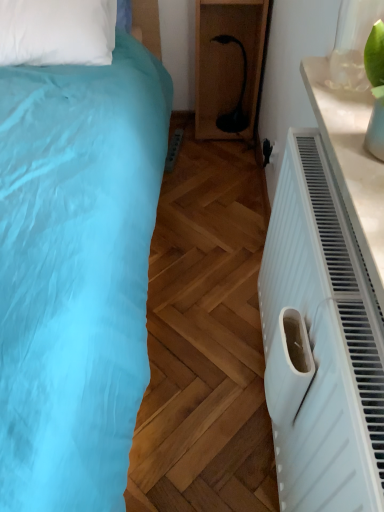
Question: Is black plastic lamp at center wider than white plastic electric outlet at center-right?

Choices:
 (A) no
 (B) yes

Answer: (B)

Question: Is black plastic lamp at center located outside white plastic electric outlet at center-right?

Choices:
 (A) no
 (B) yes

Answer: (B)

Question: From the image's perspective, does black plastic lamp at center appear higher than white plastic electric outlet at center-right?

Choices:
 (A) no
 (B) yes

Answer: (B)

Question: From the image's perspective, does black plastic lamp at center appear lower than white plastic electric outlet at center-right?

Choices:
 (A) no
 (B) yes

Answer: (A)

Question: Is black plastic lamp at center positioned in front of white plastic electric outlet at center-right?

Choices:
 (A) yes
 (B) no

Answer: (B)

Question: Considering the relative sizes of black plastic lamp at center and white plastic electric outlet at center-right in the image provided, is black plastic lamp at center shorter than white plastic electric outlet at center-right?

Choices:
 (A) no
 (B) yes

Answer: (A)

Question: From the image's perspective, is white plastic electric outlet at center-right on black plastic lamp at center?

Choices:
 (A) no
 (B) yes

Answer: (A)

Question: Is white plastic electric outlet at center-right directly adjacent to black plastic lamp at center?

Choices:
 (A) no
 (B) yes

Answer: (A)

Question: Does white plastic electric outlet at center-right appear on the right side of black plastic lamp at center?

Choices:
 (A) yes
 (B) no

Answer: (A)

Question: Considering the relative positions of white plastic electric outlet at center-right and black plastic lamp at center in the image provided, is white plastic electric outlet at center-right to the left of black plastic lamp at center from the viewer's perspective?

Choices:
 (A) no
 (B) yes

Answer: (A)

Question: From a real-world perspective, is white plastic electric outlet at center-right located higher than black plastic lamp at center?

Choices:
 (A) no
 (B) yes

Answer: (A)

Question: Is black plastic lamp at center surrounded by white plastic electric outlet at center-right?

Choices:
 (A) no
 (B) yes

Answer: (A)

Question: Is black plastic lamp at center taller or shorter than white plastic electric outlet at center-right?

Choices:
 (A) tall
 (B) short

Answer: (A)